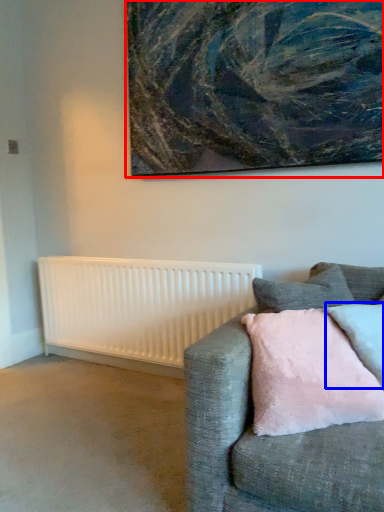
Question: Which object appears closest to the camera in this image, picture frame (highlighted by a red box) or pillow (highlighted by a blue box)?

Choices:
 (A) picture frame
 (B) pillow

Answer: (B)